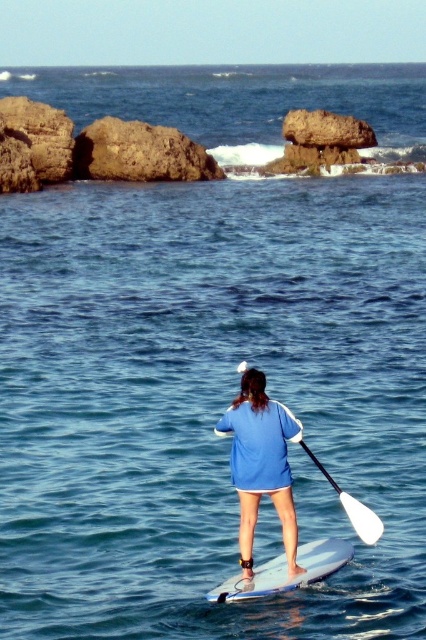
Question: Does white foam surfboard at center appear on the left side of white plastic paddle at center?

Choices:
 (A) no
 (B) yes

Answer: (B)

Question: Can you confirm if blue fabric shirt at center is wider than white plastic paddle at center?

Choices:
 (A) no
 (B) yes

Answer: (B)

Question: Which point is farther from the camera taking this photo?

Choices:
 (A) (354, 522)
 (B) (253, 595)
 (C) (270, 444)

Answer: (A)

Question: Is blue fabric shirt at center below white plastic paddle at center?

Choices:
 (A) yes
 (B) no

Answer: (B)

Question: Which of these objects is positioned closest to the white foam surfboard at center?

Choices:
 (A) white plastic paddle at center
 (B) blue fabric shirt at center

Answer: (B)

Question: Which point appears farthest from the camera in this image?

Choices:
 (A) (342, 499)
 (B) (308, 570)

Answer: (A)